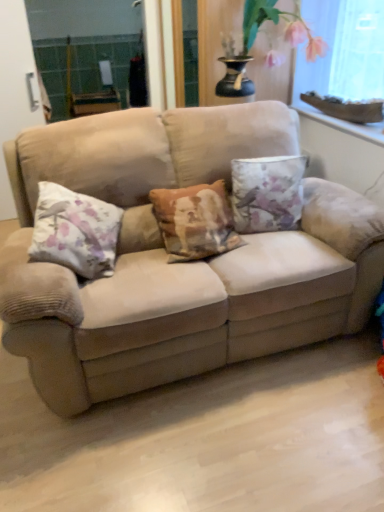
Locate an element on the screen. This screenshot has width=384, height=512. vacant space in front of beige fabric couch at center is located at coordinates (212, 438).